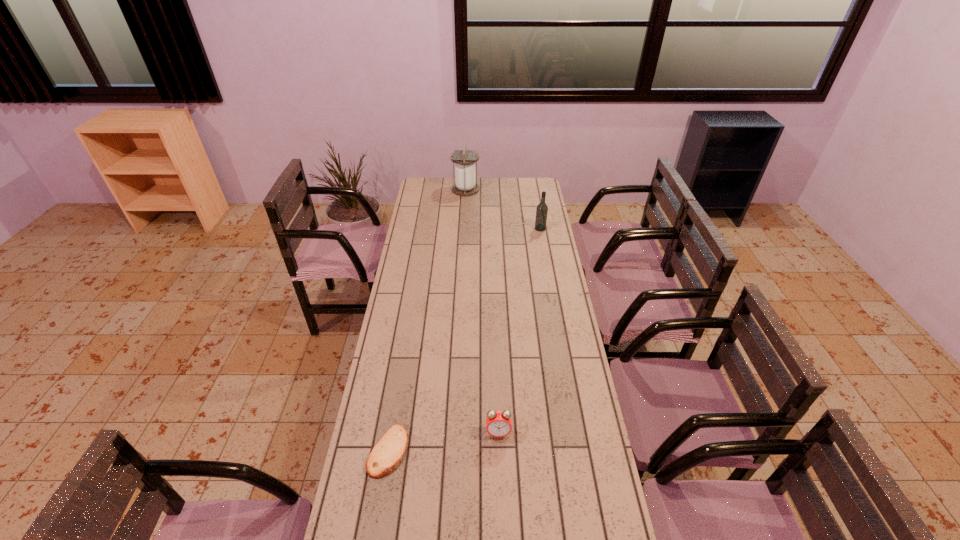
Where is `vacant space located on the front-facing side of the second object from right to left`? The image size is (960, 540). vacant space located on the front-facing side of the second object from right to left is located at coordinates (499, 467).

The image size is (960, 540). In order to click on vacant space located 0.330m on the back of the pita bread in this screenshot , I will do `click(405, 348)`.

Find the location of `object that is at the far edge`. object that is at the far edge is located at coordinates tap(465, 184).

Find the location of a particular element. object that is at the left edge is located at coordinates tap(389, 451).

Locate an element on the screen. The image size is (960, 540). object present at the right edge is located at coordinates (x=542, y=209).

I want to click on blank space at the far edge of the desktop, so click(488, 194).

At what (x,y) coordinates should I click in order to perform the action: click on vacant space at the left edge of the desktop. Please return your answer as a coordinate pair (x, y). Image resolution: width=960 pixels, height=540 pixels. Looking at the image, I should click on (392, 386).

In the image, there is a desktop. Where is `vacant space at the right edge`? This screenshot has width=960, height=540. vacant space at the right edge is located at coordinates (574, 372).

I want to click on free space at the far left corner, so click(423, 195).

At what (x,y) coordinates should I click in order to perform the action: click on vacant region at the far right corner. Please return your answer as a coordinate pair (x, y). The height and width of the screenshot is (540, 960). Looking at the image, I should click on (543, 185).